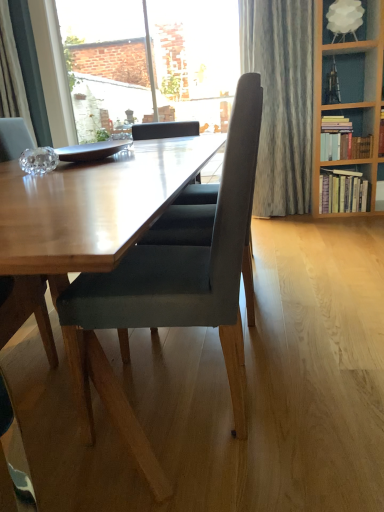
You are a GUI agent. You are given a task and a screenshot of the screen. Output one action in this format:
    pyautogui.click(x=<x>, y=<y>)
    Task: Click on the free spot below velvet grey chair at center (from a real-world perspective)
    Image resolution: width=384 pixels, height=512 pixels.
    Given the screenshot: What is the action you would take?
    pyautogui.click(x=175, y=398)